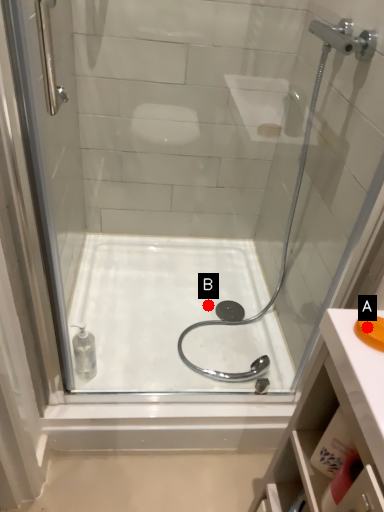
Question: Two points are circled on the image, labeled by A and B beside each circle. Which of the following is the farthest from the observer?

Choices:
 (A) A is further
 (B) B is further

Answer: (B)